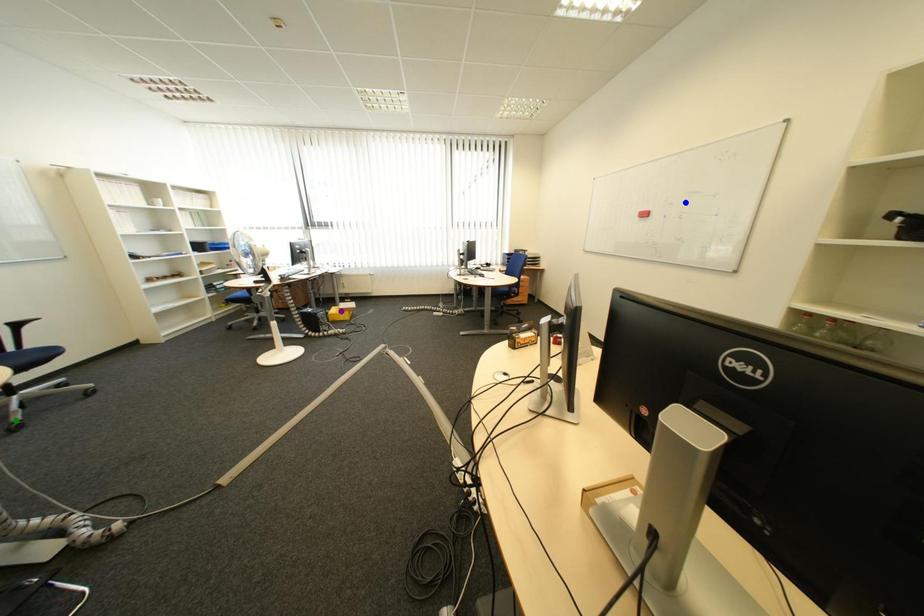
Order these from nearest to farthest:
green point, blue point, purple point

purple point, blue point, green point